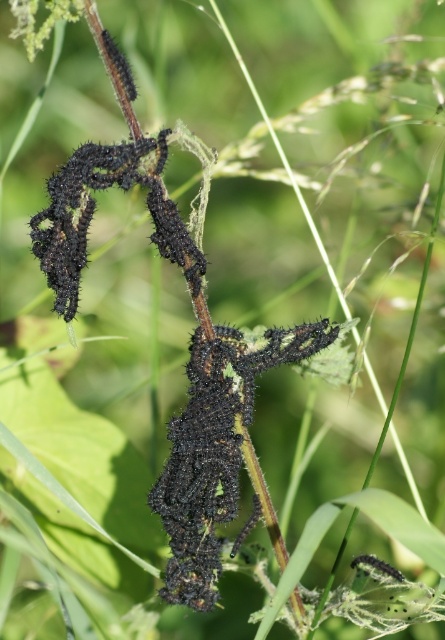
Image resolution: width=445 pixels, height=640 pixels. Identify the location of black fuzzy caterpillar at center. (215, 449).

Is black fuzzy caterpillar at center closer to camera compared to black fuzzy caterpillar at upper left?

No, black fuzzy caterpillar at center is further to the viewer.

Between point (230, 465) and point (108, 45), which one is positioned in front?

Point (108, 45) is more forward.

This screenshot has width=445, height=640. Identify the location of black fuzzy caterpillar at center. (215, 449).

Is black fuzzy caterpillar at center in front of fuzzy black caterpillar at left?

No, it is behind fuzzy black caterpillar at left.

Who is shorter, black fuzzy caterpillar at center or fuzzy black caterpillar at left?

fuzzy black caterpillar at left is shorter.

Which is in front, point (218, 513) or point (162, 129)?

Point (162, 129) is in front.

Locate an element on the screen. black fuzzy caterpillar at center is located at coordinates (215, 449).

Between fuzzy black caterpillar at left and black fuzzy caterpillar at upper left, which one appears on the left side from the viewer's perspective?

fuzzy black caterpillar at left is more to the left.

Is point (68, 208) more distant than point (132, 97)?

No, it is in front of (132, 97).

This screenshot has width=445, height=640. In order to click on fuzzy black caterpillar at left in this screenshot , I will do point(93,212).